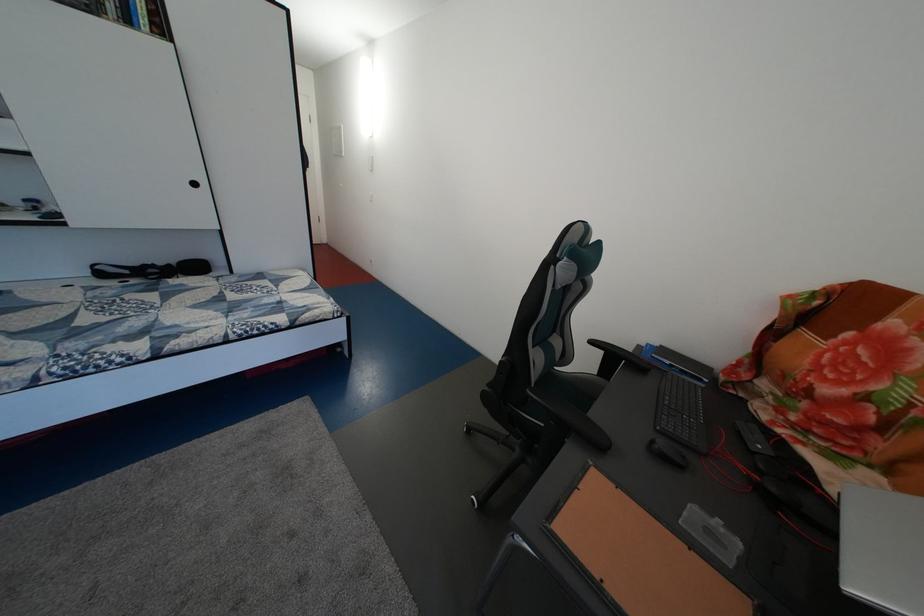
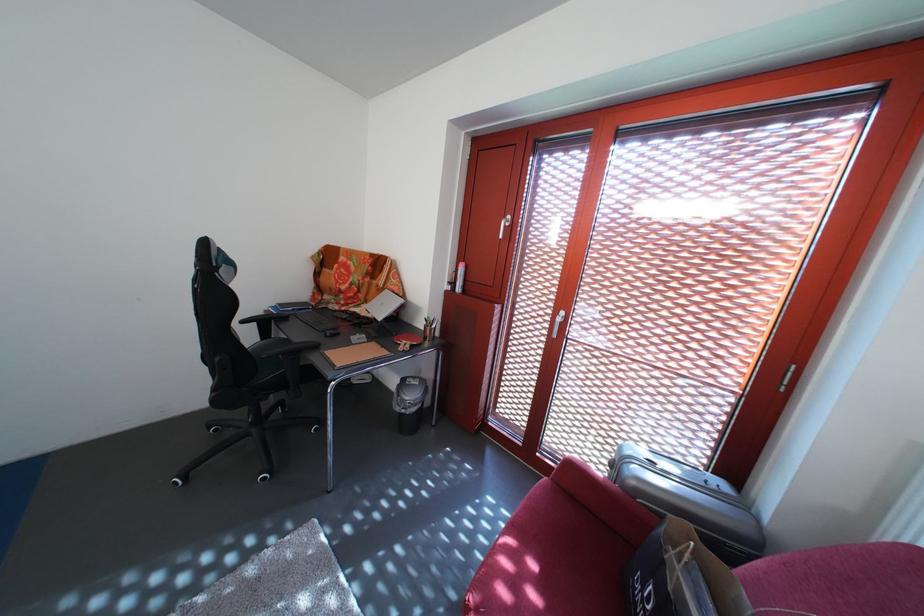
The point at (617, 376) is marked in the first image. Where is the corresponding point in the second image?

(275, 339)